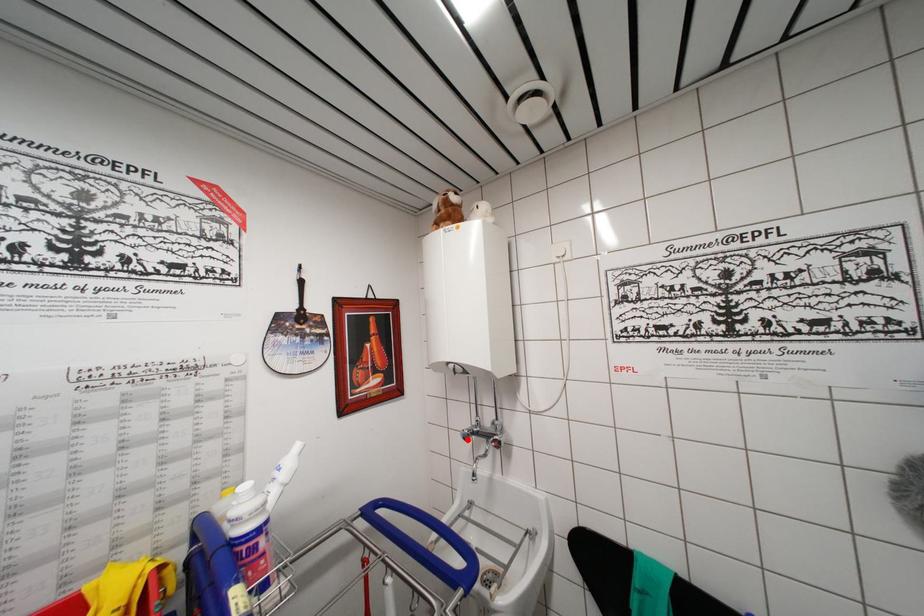
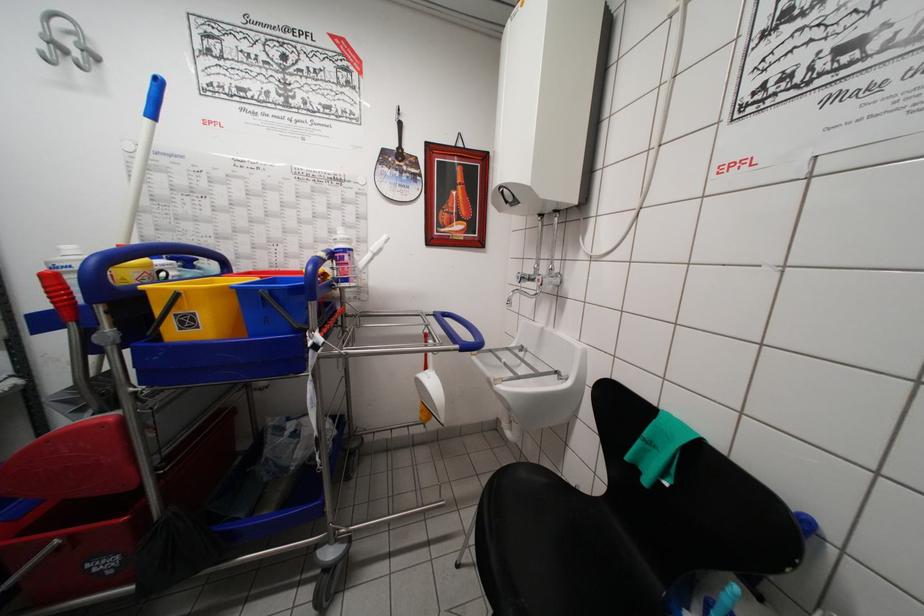
Find the pixel in the second image that matches the highlighted location in the first image.

(521, 282)